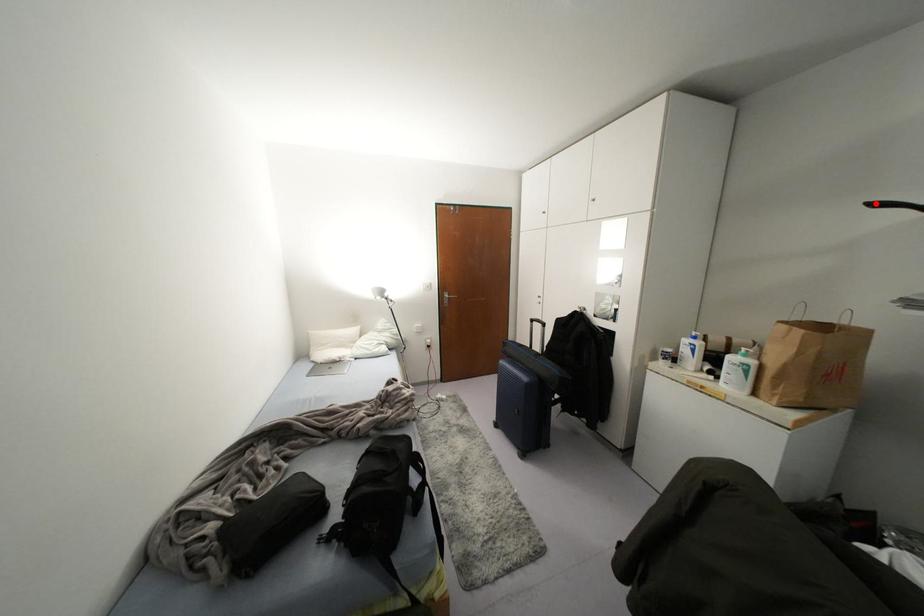
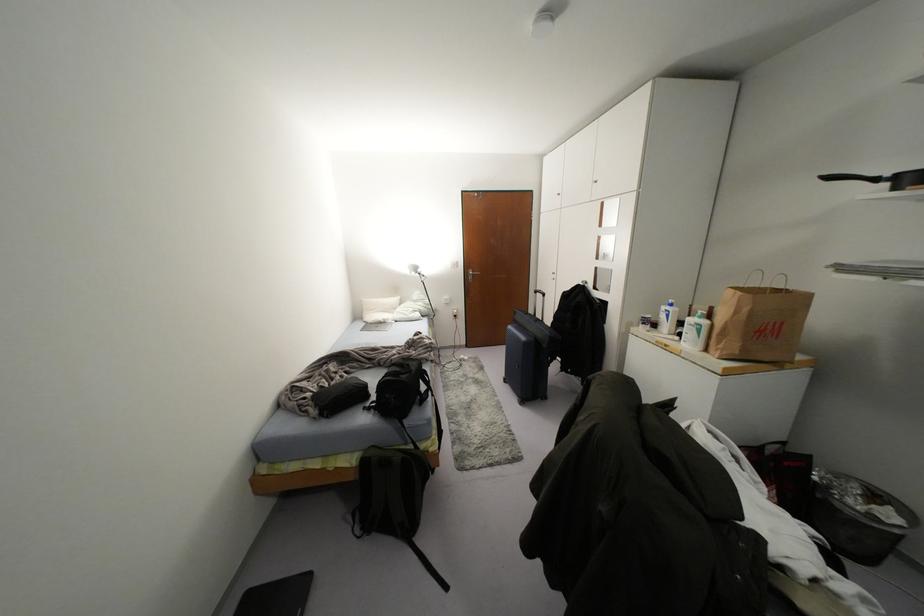
Locate, in the second image, the point that corresponds to the highlighted location in the first image.

(829, 177)